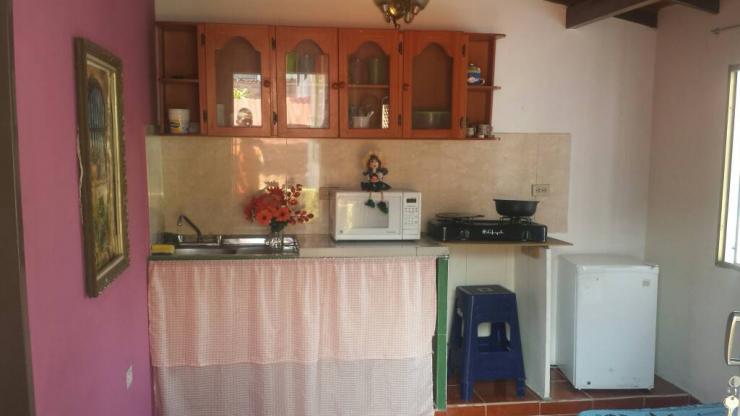
The width and height of the screenshot is (740, 416). I want to click on stool, so click(x=482, y=309).